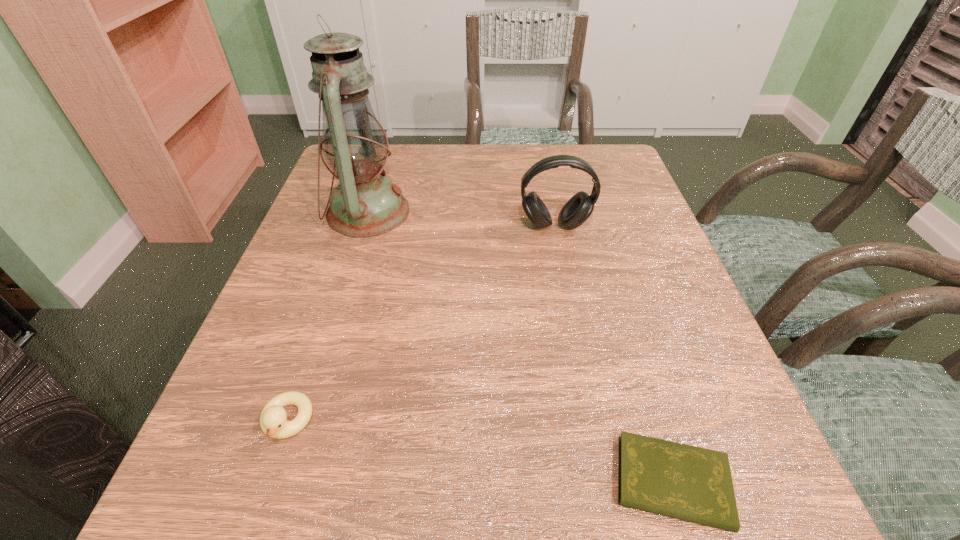
The height and width of the screenshot is (540, 960). I want to click on the tallest object, so click(x=355, y=146).

Where is `the second tallest object`? The height and width of the screenshot is (540, 960). the second tallest object is located at coordinates [578, 208].

Where is `the second shortest object`? the second shortest object is located at coordinates (273, 423).

This screenshot has width=960, height=540. I want to click on diary, so click(x=694, y=484).

The width and height of the screenshot is (960, 540). Find the location of `vacant space situated on the front of the tallest object`. vacant space situated on the front of the tallest object is located at coordinates (312, 394).

Where is `vacant area situated on the earcups of the headset`? Image resolution: width=960 pixels, height=540 pixels. vacant area situated on the earcups of the headset is located at coordinates (576, 330).

At what (x,y) coordinates should I click in order to perform the action: click on vacant space located at the beak of the duckling. Please return your answer as a coordinate pair (x, y). Looking at the image, I should click on (253, 521).

This screenshot has height=540, width=960. I want to click on vacant space situated on the back of the shortest object, so click(617, 300).

What are the coordinates of `object situated at the far edge` in the screenshot? It's located at pos(355,146).

Where is `object at the near edge`? The height and width of the screenshot is (540, 960). object at the near edge is located at coordinates (694, 484).